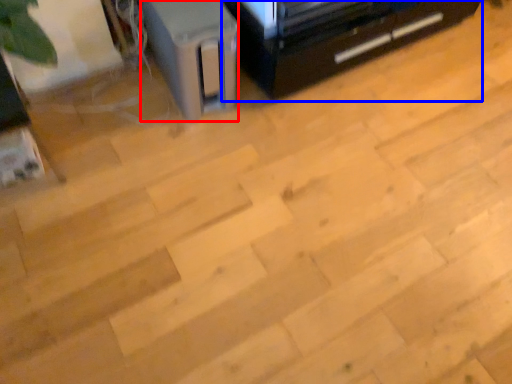
Question: Which object appears farthest to the camera in this image, appliance (highlighted by a red box) or furniture (highlighted by a blue box)?

Choices:
 (A) appliance
 (B) furniture

Answer: (B)